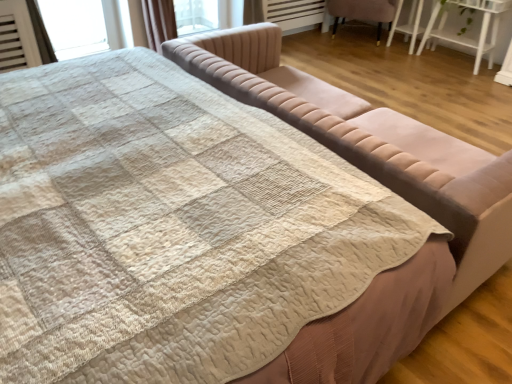
In order to face white glossy table at upper right, should I rotate leftwards or rightwards?

Rotate right and turn 25.965 degrees.

What is the approximate width of white glossy table at upper right?

white glossy table at upper right is 14.96 inches in width.

The height and width of the screenshot is (384, 512). What do you see at coordinates (362, 12) in the screenshot?
I see `velvet pink chair at upper right` at bounding box center [362, 12].

What is the approximate height of velvet pink chair at upper right?

velvet pink chair at upper right is 21.14 inches in height.

This screenshot has height=384, width=512. Describe the element at coordinates (370, 143) in the screenshot. I see `velvet beige studio couch at center` at that location.

Image resolution: width=512 pixels, height=384 pixels. In order to click on velvet beige studio couch at center in this screenshot , I will do `click(370, 143)`.

This screenshot has height=384, width=512. What are the coordinates of `white glossy table at upper right` in the screenshot? It's located at (464, 35).

From the image's perspective, is white glossy table at upper right on velvet pink chair at upper right?

No, from the image's perspective, white glossy table at upper right is not above velvet pink chair at upper right.

Based on the photo, in the image, is white glossy table at upper right on the left side or the right side of velvet pink chair at upper right?

From the image, it's evident that white glossy table at upper right is to the right of velvet pink chair at upper right.

Is point (444, 33) closer to viewer compared to point (343, 7)?

Yes, point (444, 33) is closer to viewer.

Is white glossy table at upper right taller than velvet pink chair at upper right?

Yes, white glossy table at upper right is taller than velvet pink chair at upper right.

From a real-world perspective, who is located higher, velvet pink chair at upper right or white glossy table at upper right?

From a 3D spatial view, white glossy table at upper right is above.

Image resolution: width=512 pixels, height=384 pixels. I want to click on table on the right side of velvet pink chair at upper right, so click(464, 35).

Considering the sizes of objects velvet pink chair at upper right and white glossy table at upper right in the image provided, who is thinner, velvet pink chair at upper right or white glossy table at upper right?

Thinner between the two is white glossy table at upper right.

Who is more distant, velvet pink chair at upper right or white glossy table at upper right?

velvet pink chair at upper right.

Is white glossy table at upper right inside velvet beige studio couch at center?

No, white glossy table at upper right is not surrounded by velvet beige studio couch at center.

Is velvet beige studio couch at center facing towards white glossy table at upper right?

Yes, velvet beige studio couch at center is aimed at white glossy table at upper right.

Consider the image. Can you confirm if velvet beige studio couch at center is smaller than white glossy table at upper right?

No, velvet beige studio couch at center is not smaller than white glossy table at upper right.

From the picture: From the image's perspective, would you say velvet beige studio couch at center is shown under white glossy table at upper right?

Correct, velvet beige studio couch at center appears lower than white glossy table at upper right in the image.

From the image's perspective, is velvet beige studio couch at center above velvet pink chair at upper right?

No.

Locate an element on the screen. This screenshot has height=384, width=512. chair above the velvet beige studio couch at center (from the image's perspective) is located at coordinates (362, 12).

Between velvet pink chair at upper right and velvet beige studio couch at center, which one is positioned behind?

velvet pink chair at upper right is further from the camera.

Can velvet beige studio couch at center be found inside velvet pink chair at upper right?

That's incorrect, velvet beige studio couch at center is not inside velvet pink chair at upper right.

From the image's perspective, does velvet pink chair at upper right appear lower than velvet beige studio couch at center?

No, from the image's perspective, velvet pink chair at upper right is not beneath velvet beige studio couch at center.

What's the angular difference between velvet pink chair at upper right and velvet beige studio couch at center's facing directions?

The angle between the facing direction of velvet pink chair at upper right and the facing direction of velvet beige studio couch at center is 154 degrees.

Can you confirm if white glossy table at upper right is smaller than velvet beige studio couch at center?

Yes, white glossy table at upper right is smaller than velvet beige studio couch at center.

Is white glossy table at upper right directly adjacent to velvet beige studio couch at center?

No, white glossy table at upper right is not touching velvet beige studio couch at center.

From a real-world perspective, who is located lower, white glossy table at upper right or velvet beige studio couch at center?

white glossy table at upper right.

This screenshot has width=512, height=384. I want to click on table above the velvet pink chair at upper right (from a real-world perspective), so click(464, 35).

I want to click on chair behind the white glossy table at upper right, so click(x=362, y=12).

Which object lies nearer to the anchor point velvet pink chair at upper right, velvet beige studio couch at center or white glossy table at upper right?

white glossy table at upper right is closer to velvet pink chair at upper right.

Considering their positions, is velvet pink chair at upper right positioned further to velvet beige studio couch at center than white glossy table at upper right?

Based on the image, velvet pink chair at upper right appears to be further to velvet beige studio couch at center.

From the image, which object appears to be farther from white glossy table at upper right, velvet beige studio couch at center or velvet pink chair at upper right?

velvet beige studio couch at center is positioned further to the anchor white glossy table at upper right.

Looking at the image, which one is located closer to white glossy table at upper right, velvet pink chair at upper right or velvet beige studio couch at center?

velvet pink chair at upper right lies closer to white glossy table at upper right than the other object.

Which object lies nearer to the anchor point velvet pink chair at upper right, white glossy table at upper right or velvet beige studio couch at center?

Among the two, white glossy table at upper right is located nearer to velvet pink chair at upper right.

Looking at the image, which one is located closer to velvet beige studio couch at center, white glossy table at upper right or velvet pink chair at upper right?

Based on the image, white glossy table at upper right appears to be nearer to velvet beige studio couch at center.

Identify the location of table between velvet beige studio couch at center and velvet pink chair at upper right from front to back. The width and height of the screenshot is (512, 384). (464, 35).